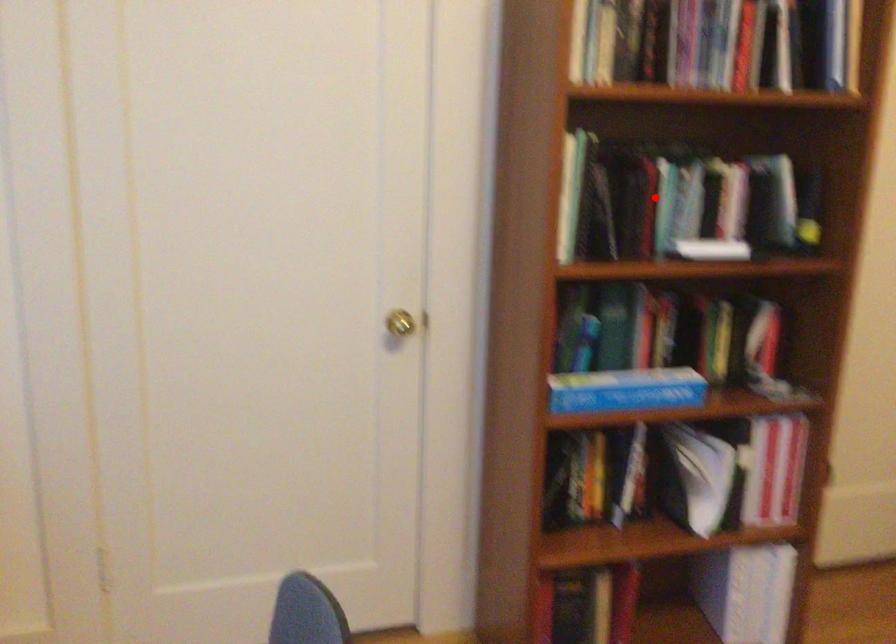
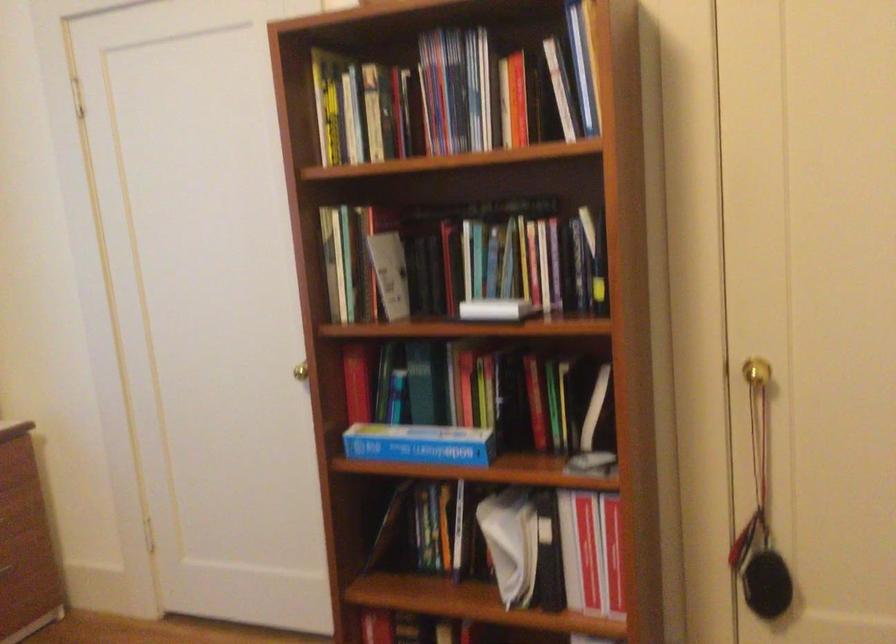
Where in the second image is the point corresponding to the highlighted location from the first image?

(467, 260)